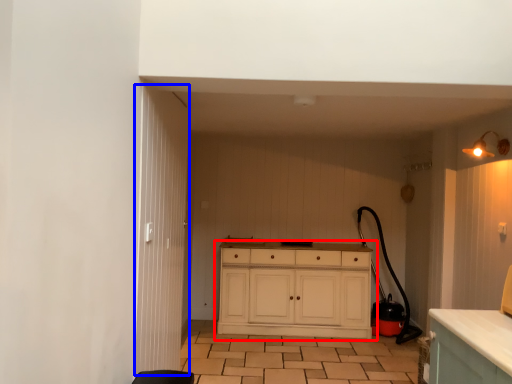
Question: Which point is closer to the camera, chest of drawers (highlighted by a red box) or door (highlighted by a blue box)?

Choices:
 (A) chest of drawers
 (B) door

Answer: (B)